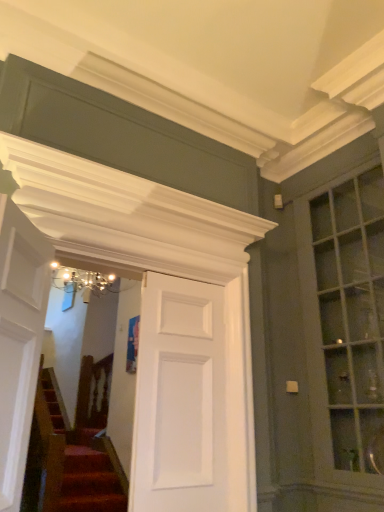
Question: Does matte glass window at right have a greater width compared to white matte door at center, placed as the 2th door when sorted from front to back?

Choices:
 (A) no
 (B) yes

Answer: (B)

Question: Is white matte door at center, which is the 1th door from back to front, completely or partially inside matte glass window at right?

Choices:
 (A) no
 (B) yes

Answer: (A)

Question: Is matte glass window at right beside white matte door at center, positioned as the 1th door in right-to-left order?

Choices:
 (A) no
 (B) yes

Answer: (A)

Question: Can you confirm if matte glass window at right is shorter than white matte door at center, which is the 1th door from back to front?

Choices:
 (A) no
 (B) yes

Answer: (A)

Question: Is matte glass window at right positioned with its back to white matte door at center, placed as the 2th door when sorted from front to back?

Choices:
 (A) yes
 (B) no

Answer: (B)

Question: From the image's perspective, is matte glass window at right positioned above or below white matte door at center, positioned as the 1th door in right-to-left order?

Choices:
 (A) below
 (B) above

Answer: (B)

Question: Considering the relative positions of matte glass window at right and white matte door at center, positioned as the 1th door in right-to-left order, in the image provided, is matte glass window at right to the left or to the right of white matte door at center, positioned as the 1th door in right-to-left order,?

Choices:
 (A) left
 (B) right

Answer: (B)

Question: Considering the positions of matte glass window at right and white matte door at center, positioned as the 1th door in right-to-left order, in the image, is matte glass window at right taller or shorter than white matte door at center, positioned as the 1th door in right-to-left order,?

Choices:
 (A) tall
 (B) short

Answer: (A)

Question: Considering the positions of point (377, 367) and point (148, 398), is point (377, 367) closer or farther from the camera than point (148, 398)?

Choices:
 (A) farther
 (B) closer

Answer: (A)

Question: In the image, is matte glass window at right positioned in front of or behind white glossy door at left, which ranks as the 1th door in front-to-back order?

Choices:
 (A) front
 (B) behind

Answer: (B)

Question: From the image's perspective, is matte glass window at right located above or below white glossy door at left, the second door viewed from the back?

Choices:
 (A) above
 (B) below

Answer: (B)

Question: In the image, is matte glass window at right on the left side or the right side of white glossy door at left, positioned as the first door in left-to-right order?

Choices:
 (A) left
 (B) right

Answer: (B)

Question: Is matte glass window at right wider or thinner than white glossy door at left, positioned as the first door in left-to-right order?

Choices:
 (A) wide
 (B) thin

Answer: (A)

Question: From a real-world perspective, relative to matte glass window at right, is white glossy door at left, which ranks as the 1th door in front-to-back order, vertically above or below?

Choices:
 (A) above
 (B) below

Answer: (B)

Question: Considering the relative positions of white glossy door at left, the second door viewed from the back, and matte glass window at right in the image provided, is white glossy door at left, the second door viewed from the back, to the left or to the right of matte glass window at right?

Choices:
 (A) left
 (B) right

Answer: (A)